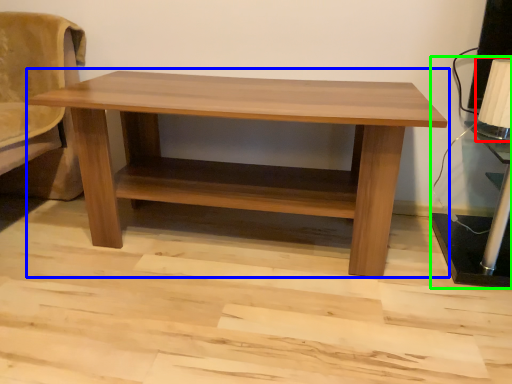
Question: Which object is positioned farthest from table lamp (highlighted by a red box)? Select from table (highlighted by a blue box) and table lamp (highlighted by a green box).

Choices:
 (A) table
 (B) table lamp

Answer: (A)